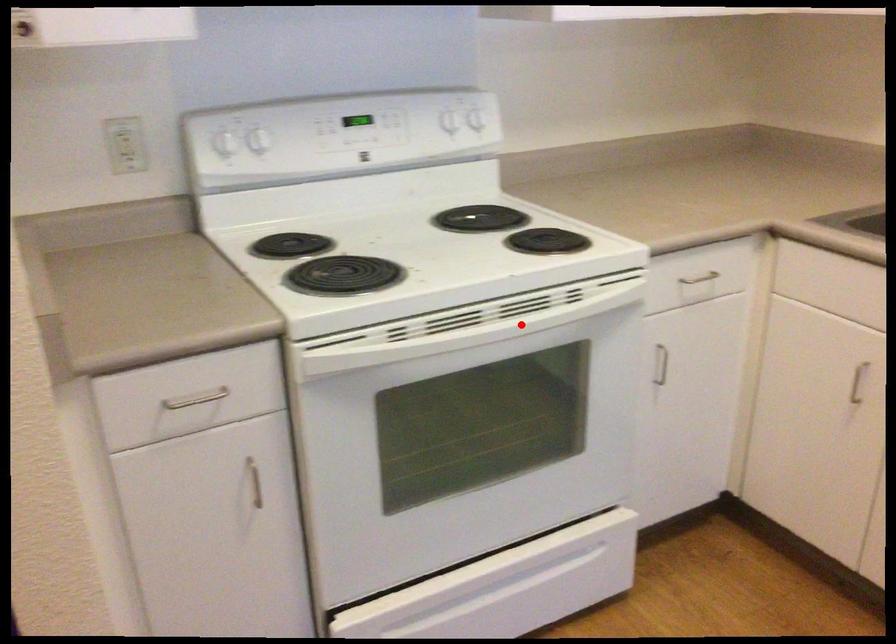
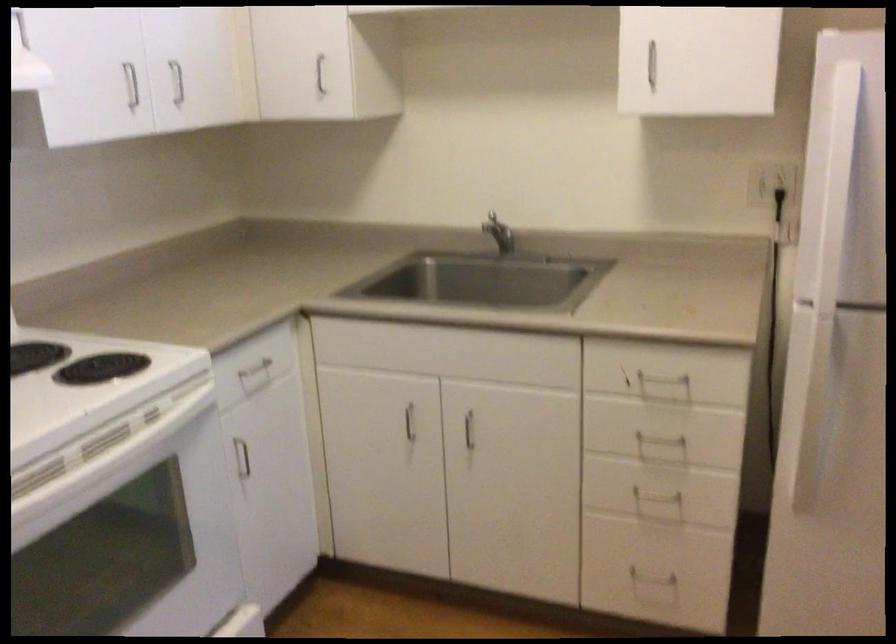
Locate, in the second image, the point that corresponds to the highlighted location in the first image.

(108, 459)